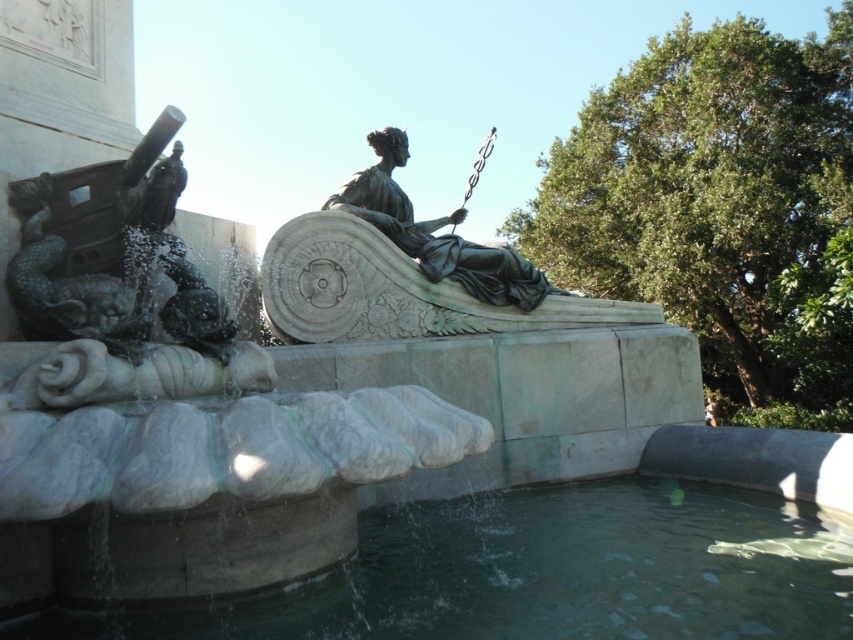
Based on the photo, you are standing in front of the fountain sculpture and want to pour water from the clear water at lower center onto the bronze statue at center. Can you do this without moving either object?

The clear water at lower center is to the right of bronze statue at center, so you cannot pour water from the clear water at lower center onto the bronze statue at center without moving either object because the water is positioned to the right of the statue, not above or in a position to naturally flow towards it.

You are standing in front of the fountain sculpture and want to know if the clear water at lower center can reach the top of the bronze statue at center. Based on their heights, what do you think?

The clear water at lower center has a greater height compared to bronze statue at center, so the water can reach the top of the bronze statue at center.

You are a maintenance worker checking the fountain sculpture. You need to determine if the clear water at lower center can cover the entire length of the polished bronze cannon at left. Can you confirm this?

The clear water at lower center might be wider than polished bronze cannon at left, so it is possible that the water could cover the cannon entirely. However, without exact measurements, this is uncertain.